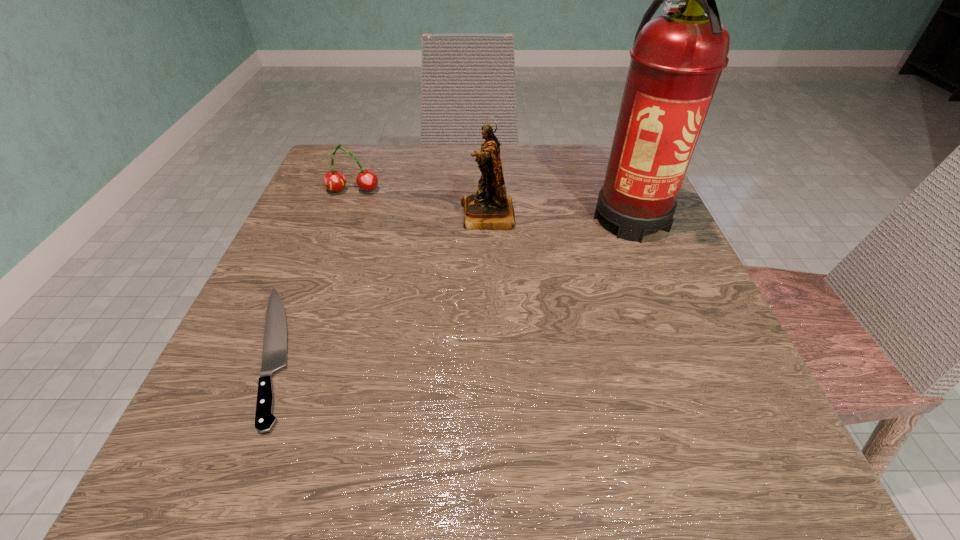
Identify the location of the tallest object. Image resolution: width=960 pixels, height=540 pixels. (677, 58).

Where is `the rightmost object`? Image resolution: width=960 pixels, height=540 pixels. the rightmost object is located at coordinates (677, 58).

The height and width of the screenshot is (540, 960). In order to click on the second tallest object in this screenshot , I will do `click(491, 208)`.

Where is `the second object from right to left`? Image resolution: width=960 pixels, height=540 pixels. the second object from right to left is located at coordinates (491, 208).

You are a GUI agent. You are given a task and a screenshot of the screen. Output one action in this format:
    pyautogui.click(x=<x>, y=<y>)
    Task: Click on the third tallest object
    
    Given the screenshot: What is the action you would take?
    pyautogui.click(x=367, y=180)

Identify the location of steak knife. (274, 356).

Find the location of a particular element. the nearest object is located at coordinates (274, 356).

The width and height of the screenshot is (960, 540). Find the location of `vacant space located 0.270m on the front-facing side of the fire extinguisher`. vacant space located 0.270m on the front-facing side of the fire extinguisher is located at coordinates (701, 387).

This screenshot has height=540, width=960. What are the coordinates of `free point located 0.070m on the front-facing side of the third shortest object` in the screenshot? It's located at (425, 215).

The height and width of the screenshot is (540, 960). I want to click on vacant region located 0.290m on the front-facing side of the third shortest object, so click(316, 215).